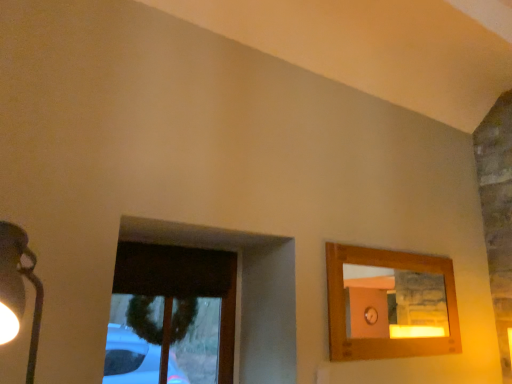
What do you see at coordinates (244, 292) in the screenshot? This screenshot has width=512, height=384. I see `brown fabric window at lower left` at bounding box center [244, 292].

Measure the distance between brown fabric window at lower left and camera.

The depth of brown fabric window at lower left is 2.06 meters.

In order to face brown fabric window at lower left, should I rotate leftwards or rightwards?

Turn left approximately 10.768 degrees to face it.

Where is `brown fabric window at lower left`? The height and width of the screenshot is (384, 512). brown fabric window at lower left is located at coordinates (244, 292).

Image resolution: width=512 pixels, height=384 pixels. Find the location of `brown fabric window at lower left`. brown fabric window at lower left is located at coordinates (244, 292).